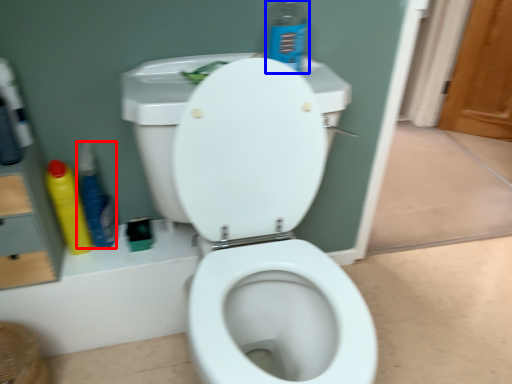
Question: Which point is closer to the camera, cleaning product (highlighted by a red box) or cleaning product (highlighted by a blue box)?

Choices:
 (A) cleaning product
 (B) cleaning product

Answer: (B)